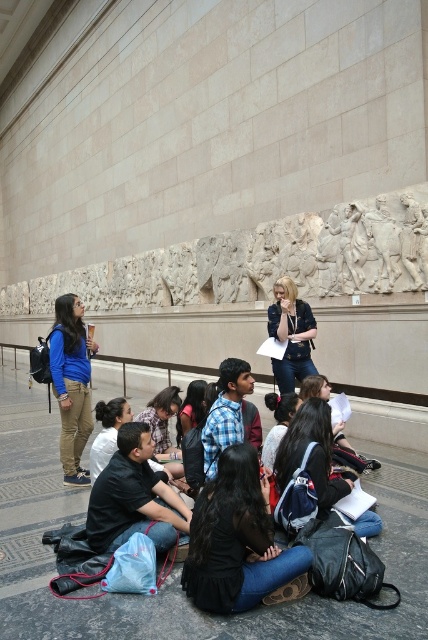
Question: Is matte blue shirt at lower left closer to camera compared to white marble relief at upper center?

Choices:
 (A) no
 (B) yes

Answer: (B)

Question: Does matte blue shirt at lower left appear on the right side of white marble relief at upper center?

Choices:
 (A) yes
 (B) no

Answer: (B)

Question: Does matte blue shirt at lower left have a smaller size compared to white marble relief at upper center?

Choices:
 (A) no
 (B) yes

Answer: (A)